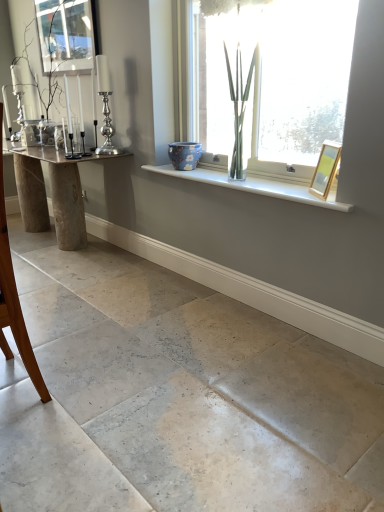
Where is `unoccupied region to the right of brown wooden chair at left`? The width and height of the screenshot is (384, 512). unoccupied region to the right of brown wooden chair at left is located at coordinates (87, 390).